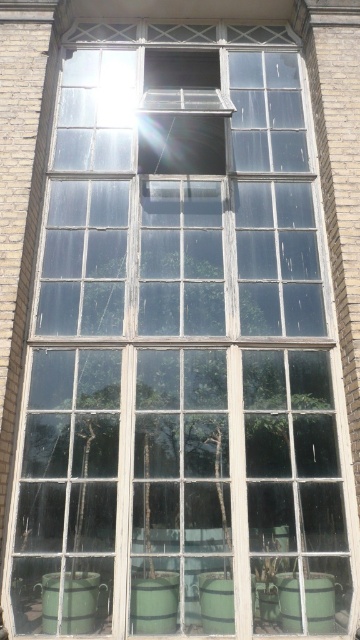
Question: Is the position of green wooden barrel at lower left more distant than that of green wooden barrel at lower center?

Choices:
 (A) yes
 (B) no

Answer: (B)

Question: Is green wooden barrel at lower left bigger than green wooden barrel at lower right?

Choices:
 (A) yes
 (B) no

Answer: (A)

Question: Among these points, which one is nearest to the camera?

Choices:
 (A) (307, 580)
 (B) (213, 625)

Answer: (B)

Question: Among these points, which one is farthest from the camera?

Choices:
 (A) (78, 576)
 (B) (313, 609)
 (C) (227, 573)

Answer: (C)

Question: From the image, what is the correct spatial relationship of green wooden barrel at lower left in relation to green wooden barrel at lower center?

Choices:
 (A) left
 (B) right

Answer: (A)

Question: Among these points, which one is farthest from the camera?

Choices:
 (A) (68, 588)
 (B) (281, 582)

Answer: (B)